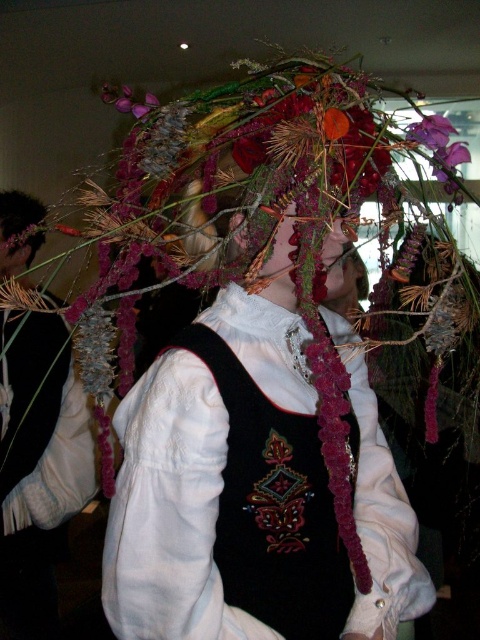
Does embroidered velvet vest at center have a greater width compared to matte black hair at upper left?

Indeed, embroidered velvet vest at center has a greater width compared to matte black hair at upper left.

Between embroidered velvet vest at center and matte black hair at upper left, which one has less height?

Standing shorter between the two is matte black hair at upper left.

This screenshot has height=640, width=480. I want to click on embroidered velvet vest at center, so click(252, 484).

This screenshot has height=640, width=480. What are the coordinates of `embroidered velvet vest at center` in the screenshot? It's located at (252, 484).

Does burgundy fabric headdress at center appear over fuzzy floral crown at center?

No.

Who is shorter, burgundy fabric headdress at center or fuzzy floral crown at center?

Standing shorter between the two is burgundy fabric headdress at center.

Measure the distance between point (336, 257) and camera.

34.06 inches

Locate an element on the screen. The height and width of the screenshot is (640, 480). burgundy fabric headdress at center is located at coordinates (280, 264).

Between fuzzy black vest at center and purple fabric flower at upper center, which one is positioned lower?

fuzzy black vest at center is lower down.

From the picture: Is fuzzy black vest at center above purple fabric flower at upper center?

Actually, fuzzy black vest at center is below purple fabric flower at upper center.

Is point (70, 387) farther from viewer compared to point (429, 148)?

Yes, it is.

Locate an element on the screen. This screenshot has height=640, width=480. fuzzy black vest at center is located at coordinates (37, 467).